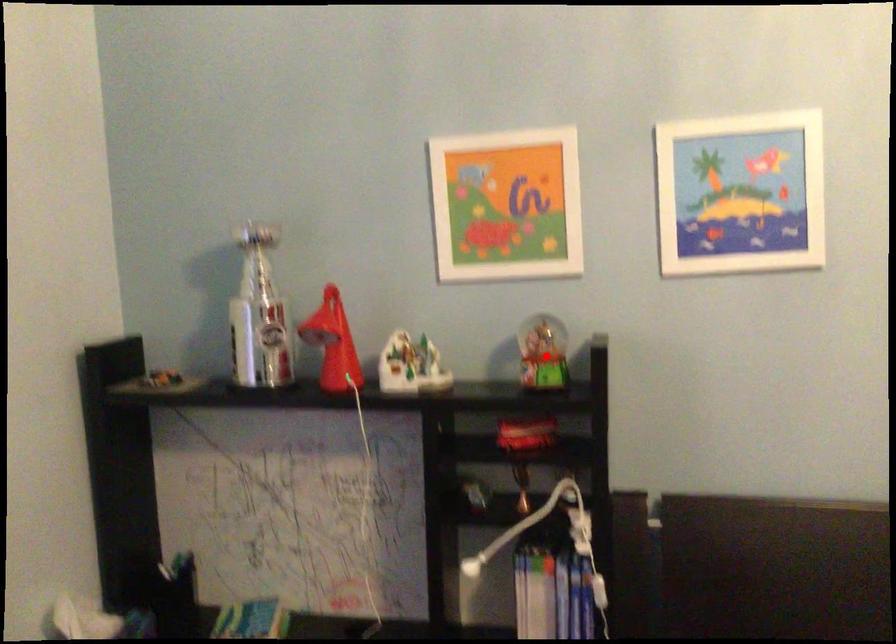
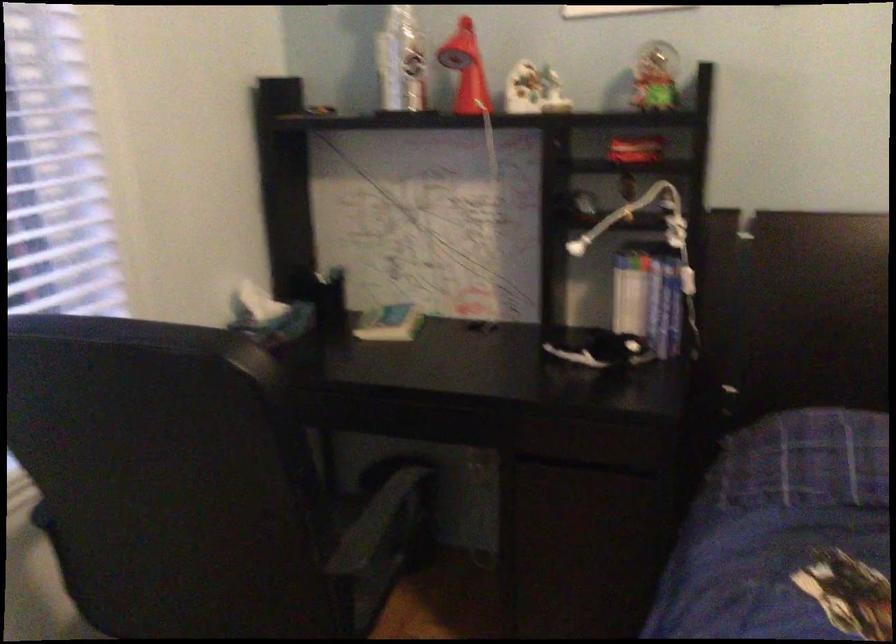
Locate, in the second image, the point that corresponds to the highlighted location in the first image.

(655, 77)